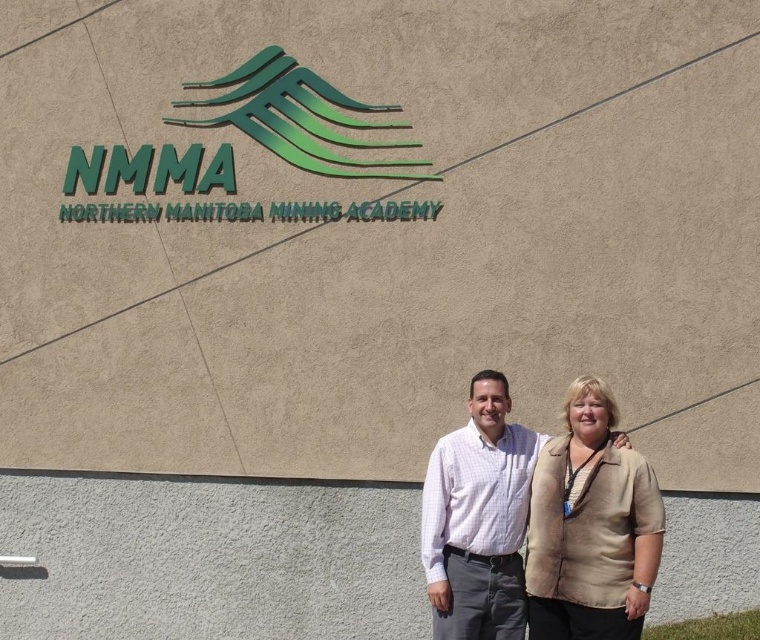
In the scene shown: Who is shorter, beige fabric jacket at lower right or white checkered shirt at center?

With less height is beige fabric jacket at lower right.

The width and height of the screenshot is (760, 640). What are the coordinates of `beige fabric jacket at lower right` in the screenshot? It's located at (591, 525).